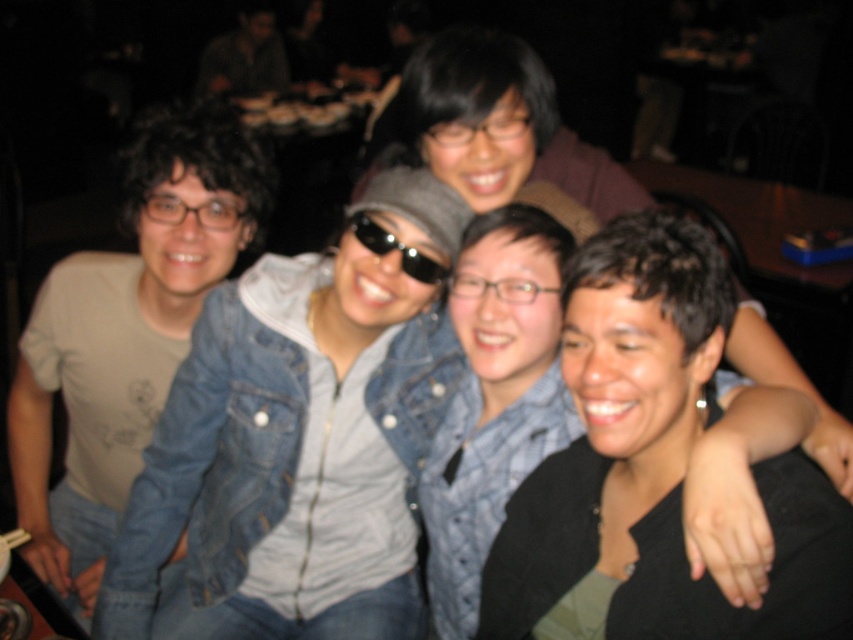
Question: From the image, what is the correct spatial relationship of denim jacket at center in relation to sunglasses at center?

Choices:
 (A) left
 (B) right

Answer: (B)

Question: Among these objects, which one is farthest from the camera?

Choices:
 (A) sunglasses at center
 (B) black matte jacket at center
 (C) light beige t-shirt at left

Answer: (C)

Question: Does black matte jacket at center have a greater width compared to light beige t-shirt at left?

Choices:
 (A) no
 (B) yes

Answer: (A)

Question: Which is nearer to the light beige t-shirt at left?

Choices:
 (A) sunglasses at center
 (B) black matte jacket at center

Answer: (A)

Question: Can you confirm if light beige t-shirt at left is wider than denim jacket at center?

Choices:
 (A) yes
 (B) no

Answer: (A)

Question: Estimate the real-world distances between objects in this image. Which object is closer to the black matte jacket at center?

Choices:
 (A) sunglasses at center
 (B) denim jacket at center

Answer: (A)